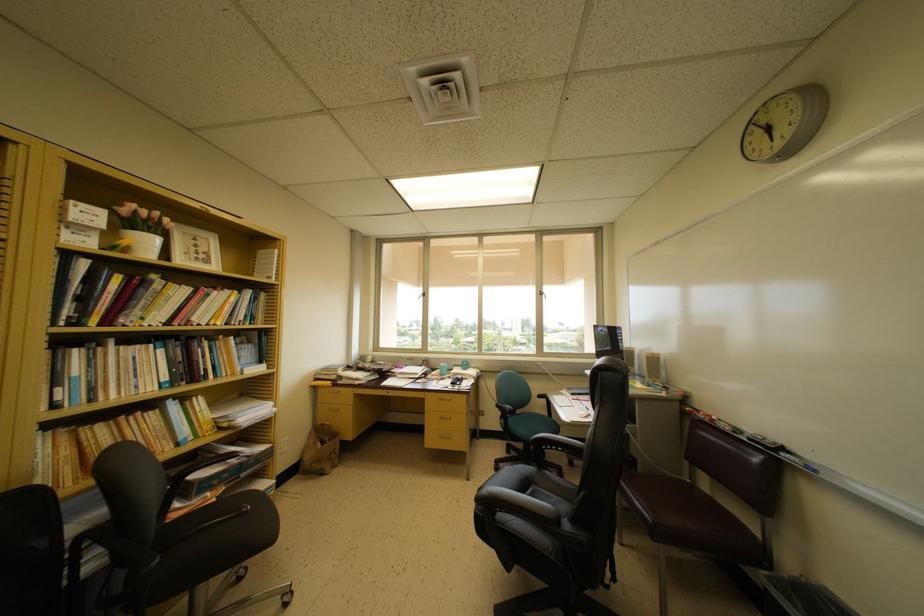
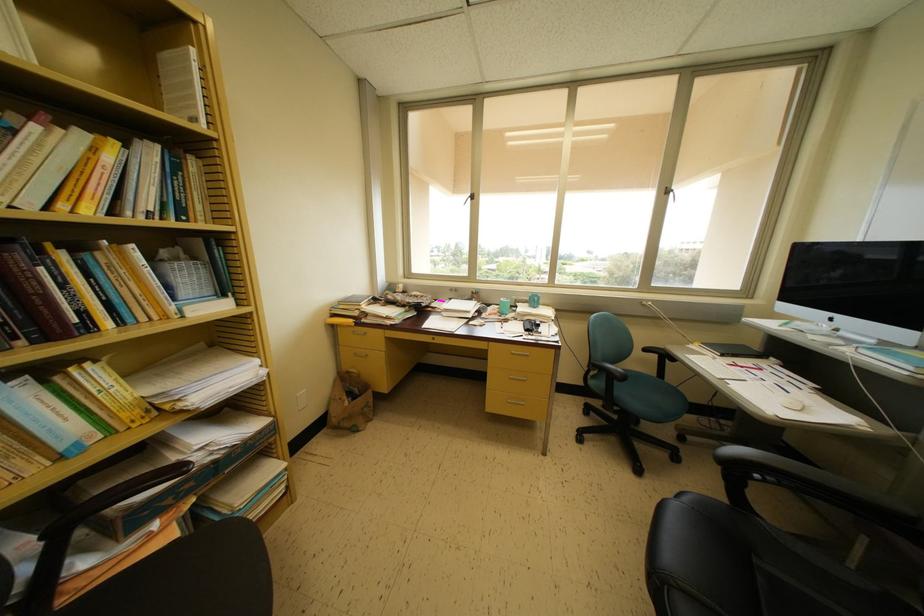
Where in the second image is the point corresponding to the point at 248,342 from the first image?

(181, 253)